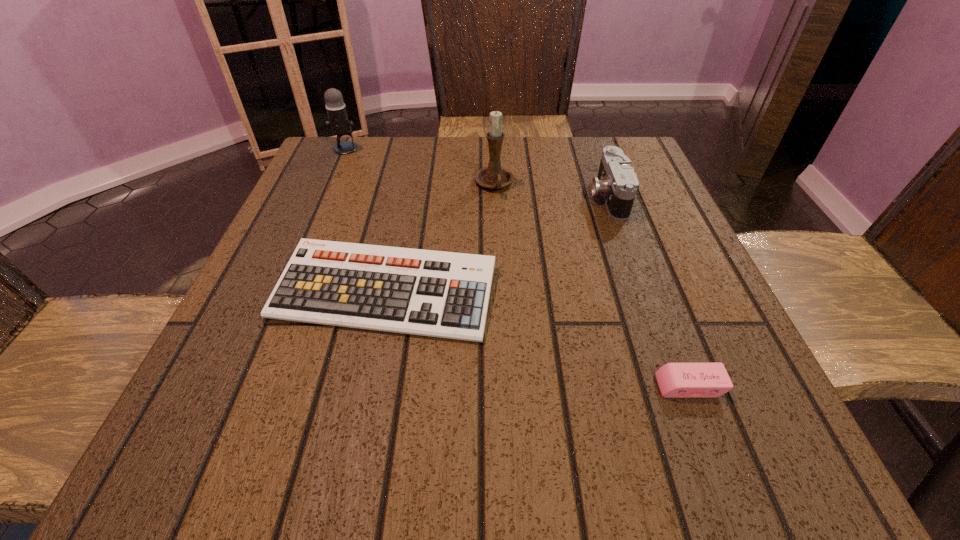
Find the location of a particular element. vacant space that is in between the third shortest object and the candle holder is located at coordinates (551, 190).

Locate an element on the screen. vacant area that lies between the fourth farthest object and the microphone is located at coordinates (366, 220).

Identify the location of blank region between the farthest object and the computer keyboard. The height and width of the screenshot is (540, 960). (366, 220).

You are a GUI agent. You are given a task and a screenshot of the screen. Output one action in this format:
    pyautogui.click(x=<x>, y=<y>)
    Task: Click on the free area in between the camera and the nearest object
    Image resolution: width=960 pixels, height=540 pixels.
    Given the screenshot: What is the action you would take?
    pyautogui.click(x=649, y=291)

Identify the location of unoccupied area between the computer keyboard and the nearest object. The image size is (960, 540). (538, 339).

Identify the location of free space between the eraser and the computer keyboard. (538, 339).

Locate an element on the screen. The height and width of the screenshot is (540, 960). free area in between the computer keyboard and the third tallest object is located at coordinates (496, 244).

Identify the location of vacant space that's between the microphone and the computer keyboard. The height and width of the screenshot is (540, 960). (366, 220).

Image resolution: width=960 pixels, height=540 pixels. I want to click on object that is the fourth closest one to the nearest object, so click(x=338, y=121).

Where is `object that can be found as the closest to the microphone`? object that can be found as the closest to the microphone is located at coordinates tap(494, 176).